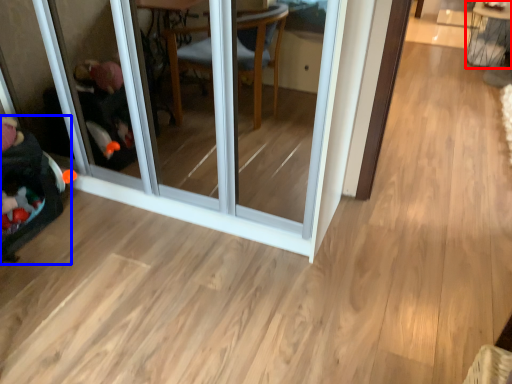
Question: Which object appears closest to the camera in this image, table (highlighted by a red box) or baby carriage (highlighted by a blue box)?

Choices:
 (A) table
 (B) baby carriage

Answer: (B)